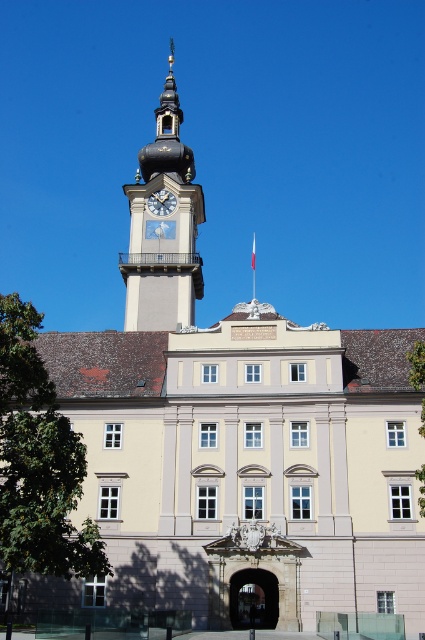
You are a visitor standing in front of the grand historic building. You notice the green leafy tree at lower left and the white painted clock at upper center. Which object appears larger in the image?

The green leafy tree at lower left appears larger than the white painted clock at upper center in the image.

You are a visitor standing in front of the grand historic building. You notice a green leafy tree at lower right and a white painted clock at upper center. Which object is located higher up in the image?

The white painted clock at upper center is located higher up in the image than the green leafy tree at lower right.